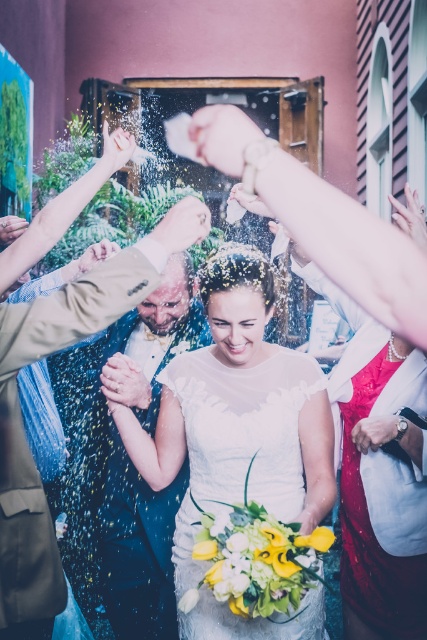
Between white sheer dress at center and light brown leather jacket at center, which one appears on the right side from the viewer's perspective?

white sheer dress at center is more to the right.

Is the position of white sheer dress at center more distant than that of light brown leather jacket at center?

Yes.

Between point (205, 497) and point (22, 435), which one is positioned behind?

Point (205, 497)

Find the location of a particular element. Image resolution: width=427 pixels, height=640 pixels. white sheer dress at center is located at coordinates (240, 404).